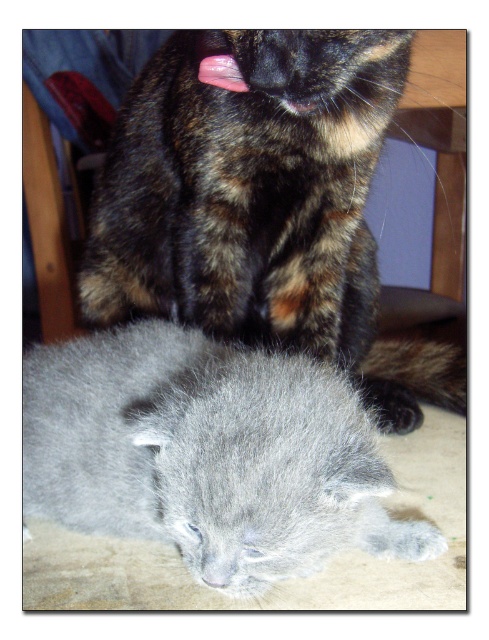
Question: Which object is closer to the camera taking this photo?

Choices:
 (A) gray fluffy kitten at lower center
 (B) fluffy tortoiseshell cat at upper center

Answer: (A)

Question: Among these points, which one is farthest from the camera?

Choices:
 (A) (214, 420)
 (B) (444, 371)

Answer: (B)

Question: Can you confirm if fluffy tortoiseshell cat at upper center is positioned to the right of gray fluffy kitten at lower center?

Choices:
 (A) yes
 (B) no

Answer: (A)

Question: Is fluffy tortoiseshell cat at upper center to the right of gray fluffy kitten at lower center from the viewer's perspective?

Choices:
 (A) yes
 (B) no

Answer: (A)

Question: Is fluffy tortoiseshell cat at upper center positioned before gray fluffy kitten at lower center?

Choices:
 (A) no
 (B) yes

Answer: (A)